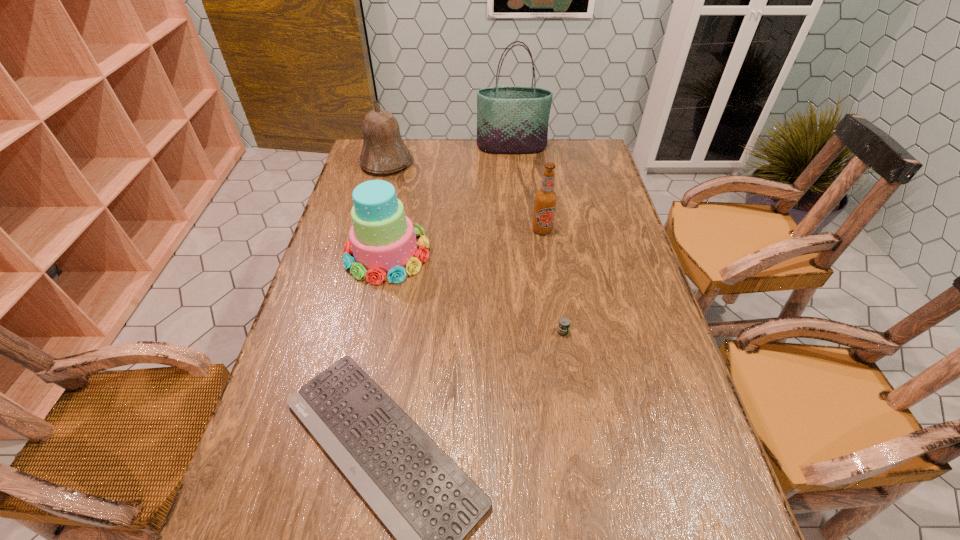
Find the location of a particular element. The image size is (960, 540). tote bag is located at coordinates (510, 119).

Where is `bell`? The height and width of the screenshot is (540, 960). bell is located at coordinates (384, 151).

Locate an element on the screen. This screenshot has width=960, height=540. beer bottle is located at coordinates (546, 198).

Identify the location of cake. (382, 240).

Find the location of a particular element. This screenshot has width=960, height=540. the second shortest object is located at coordinates (563, 328).

I want to click on beer can, so click(x=563, y=328).

Identify the location of free point located 0.200m on the left of the tallest object. (425, 147).

The width and height of the screenshot is (960, 540). In order to click on vacant space situated on the front of the bell in this screenshot , I will do `click(376, 201)`.

Find the location of a particular element. vacant area situated on the front label of the beer bottle is located at coordinates (553, 301).

Locate an element on the screen. The image size is (960, 540). vacant space located on the back of the cake is located at coordinates (404, 176).